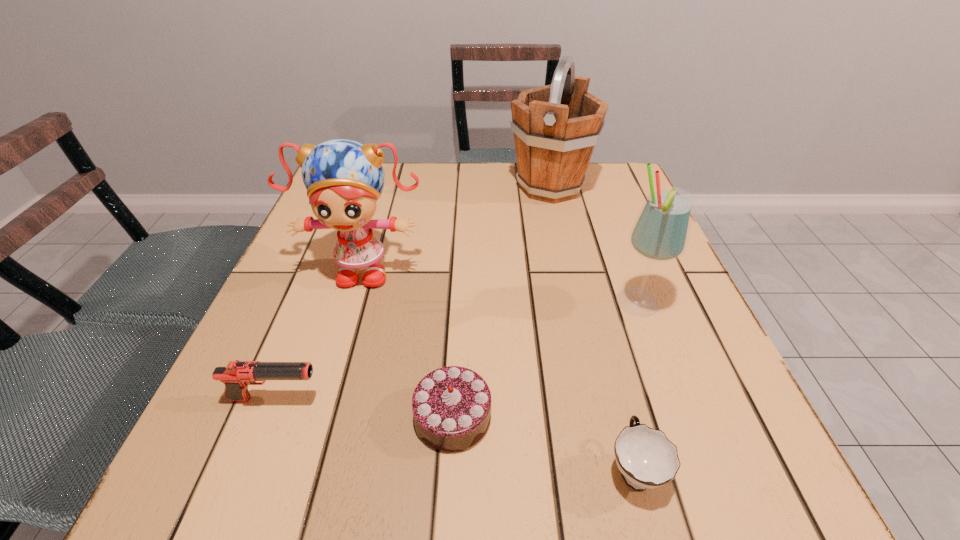
Image resolution: width=960 pixels, height=540 pixels. I want to click on alcohol that is at the right edge, so click(x=660, y=233).

In order to click on cup that is positioned at the right edge in this screenshot , I will do `click(646, 458)`.

In order to click on object present at the far right corner in this screenshot , I will do `click(556, 127)`.

Locate an element on the screen. The image size is (960, 540). object situated at the near right corner is located at coordinates (646, 458).

Locate an element on the screen. vacant space at the far edge of the desktop is located at coordinates (462, 202).

This screenshot has height=540, width=960. Identify the location of vacant space at the near edge of the desktop. (555, 449).

At what (x,y) coordinates should I click in order to perform the action: click on vacant area at the left edge. Please return your answer as a coordinate pair (x, y). This screenshot has height=540, width=960. Looking at the image, I should click on (236, 416).

Locate an element on the screen. vacant space at the right edge of the desktop is located at coordinates (613, 300).

I want to click on free location at the near right corner of the desktop, so click(684, 474).

Image resolution: width=960 pixels, height=540 pixels. I want to click on free spot between the cup and the bucket, so click(592, 328).